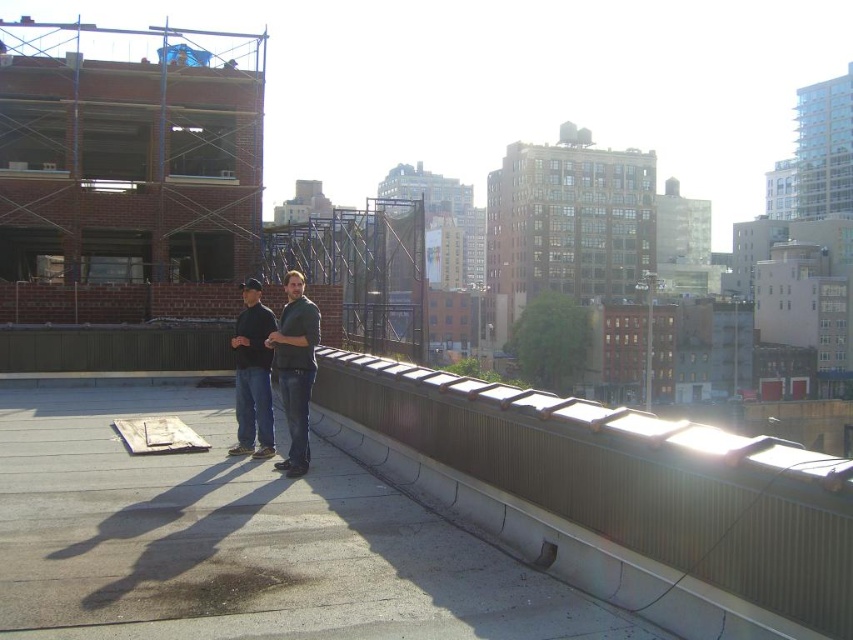
Measure the distance between point (122, 557) and camera.

Point (122, 557) is 5.13 meters away from camera.

The height and width of the screenshot is (640, 853). What are the coordinates of `gray concrete pavement at center` in the screenshot? It's located at pos(239,540).

The image size is (853, 640). Find the location of `gray concrete pavement at center`. gray concrete pavement at center is located at coordinates (239, 540).

Where is `gray concrete pavement at center`? This screenshot has height=640, width=853. gray concrete pavement at center is located at coordinates (239, 540).

Is dark gray blazer at center wider than dark gray sweater at center?

Incorrect, dark gray blazer at center's width does not surpass dark gray sweater at center's.

Which of these two, dark gray blazer at center or dark gray sweater at center, stands taller?

dark gray blazer at center

Between point (300, 353) and point (258, 404), which one is positioned in front?

Point (300, 353)

This screenshot has width=853, height=640. I want to click on dark gray blazer at center, so click(x=294, y=369).

Describe the element at coordinates (630, 477) in the screenshot. Image resolution: width=853 pixels, height=640 pixels. I see `metallic gray rail at upper right` at that location.

Is metallic gray rail at upper right bigger than dark gray sweater at center?

Indeed, metallic gray rail at upper right has a larger size compared to dark gray sweater at center.

Identify the location of metallic gray rail at upper right. (630, 477).